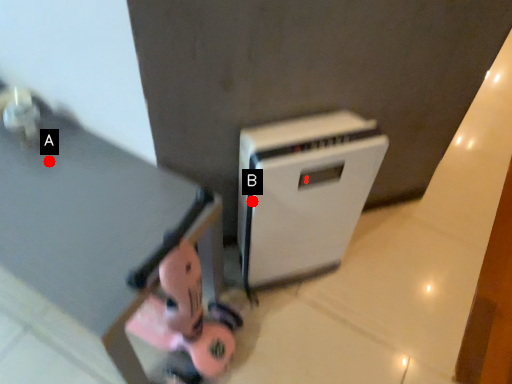
Question: Two points are circled on the image, labeled by A and B beside each circle. Which of the following is the farthest from the observer?

Choices:
 (A) A is further
 (B) B is further

Answer: (A)